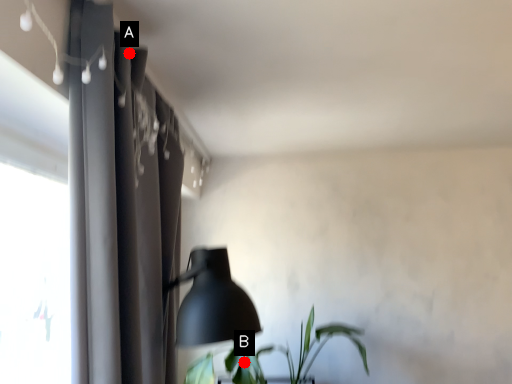
Question: Two points are circled on the image, labeled by A and B beside each circle. Which point is closer to the camera taking this photo?

Choices:
 (A) A is closer
 (B) B is closer

Answer: (A)